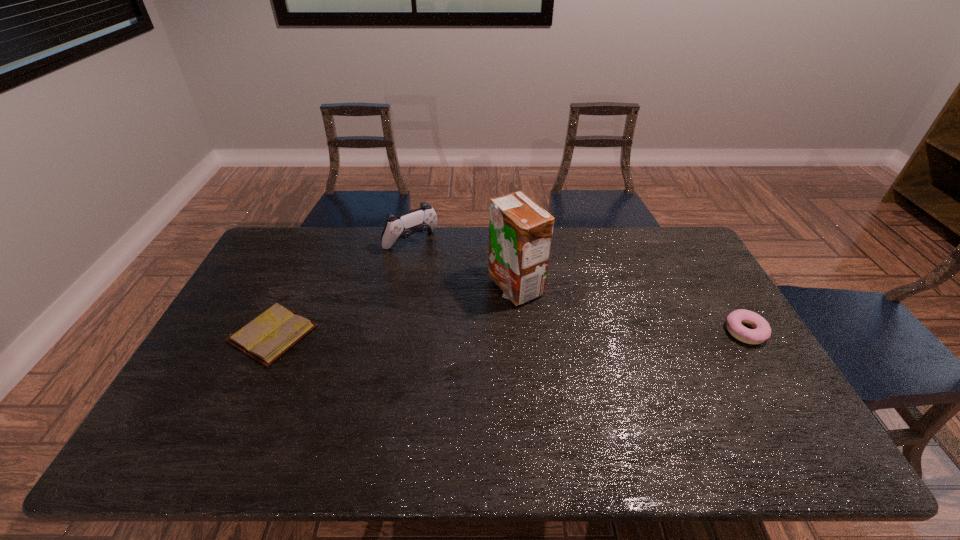
You are a GUI agent. You are given a task and a screenshot of the screen. Output one action in this format:
    pyautogui.click(x=<x>, y=<y>)
    Task: Click on the free space on the desktop that is between the shortest object and the rightmost object and is positioned on the straw side of the carton
    The height and width of the screenshot is (540, 960).
    Given the screenshot: What is the action you would take?
    pyautogui.click(x=495, y=333)

Locate an element on the screen. free spot on the desktop that is between the diary and the second shortest object and is positioned on the front-facing side of the third shortest object is located at coordinates (496, 333).